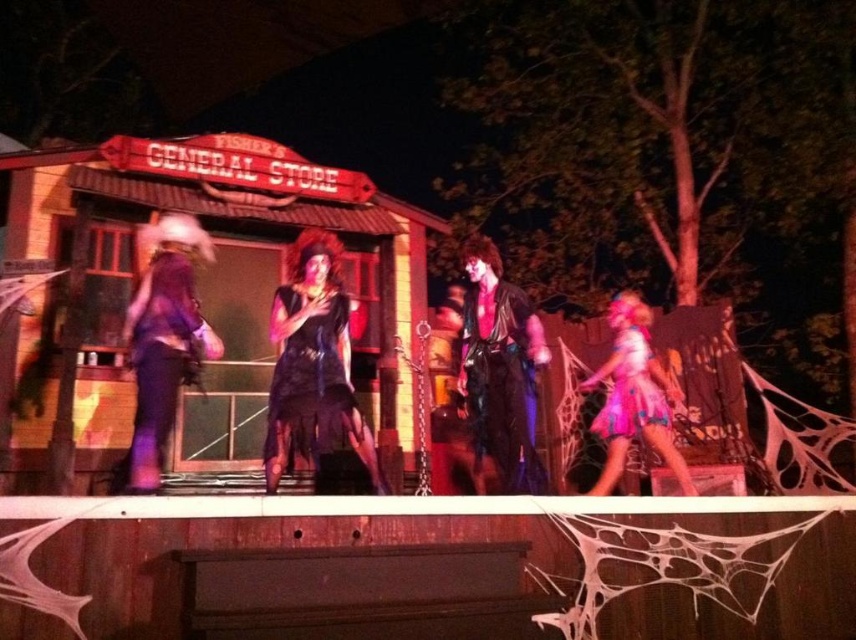
You are a photographer at the event and need to capture a photo where both the black velvet dress at center and the pink satin dress at lower right are visible. Given their heights, which dress should be placed closer to the front to ensure both are fully visible in the frame?

The pink satin dress at lower right should be placed closer to the front since it is shorter than the black velvet dress at center, allowing both to be fully visible in the photo.